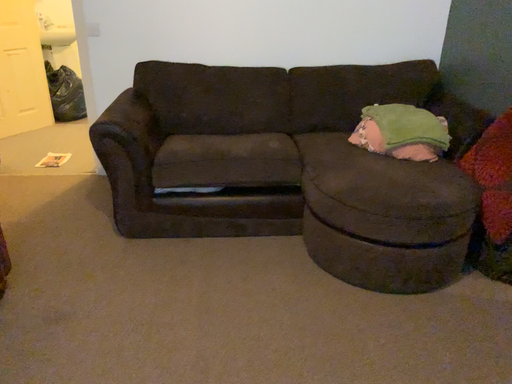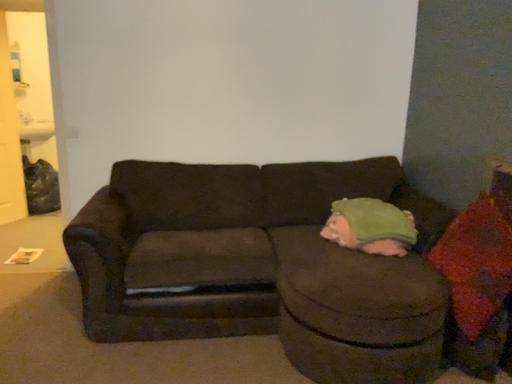
Question: Which way did the camera rotate in the video?

Choices:
 (A) rotated downward
 (B) rotated upward

Answer: (B)